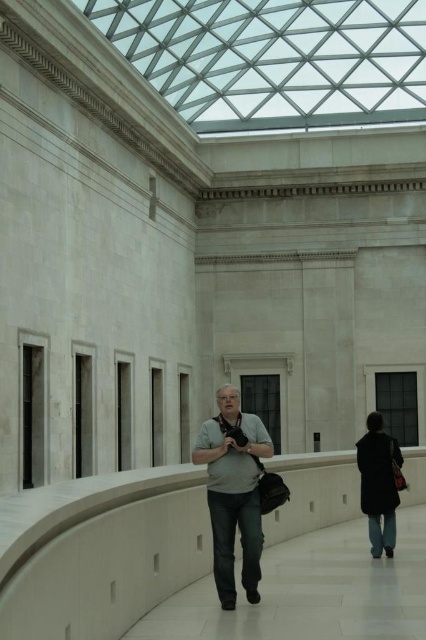
You are standing at the entrance of the museum and see the gray matte shirt at center. If you want to take a photo of the shirt without moving, where should you position yourself relative to the shirt?

The gray matte shirt at center is located at coordinates point [233,492], so you should position yourself directly in front of it to capture it in the frame without moving.

You are an architect designing a new exhibit space in this museum. You need to place a 2.5 meter tall sculpture between the gray matte shirt at center and the dark blue coat at lower right. Which object should the sculpture be placed closer to to ensure it doesn

The sculpture should be placed closer to the gray matte shirt at center because it is much taller than the dark blue coat at lower right, allowing the sculpture to be more visually balanced in the space.

You are an event planner organizing a photo shoot in this museum. You need to position a large equipment cart between the gray matte shirt at center and the dark blue coat at lower right. Considering their sizes, which object should the cart be placed closer to?

The cart should be placed closer to the dark blue coat at lower right because it occupies more space than the gray matte shirt at center.